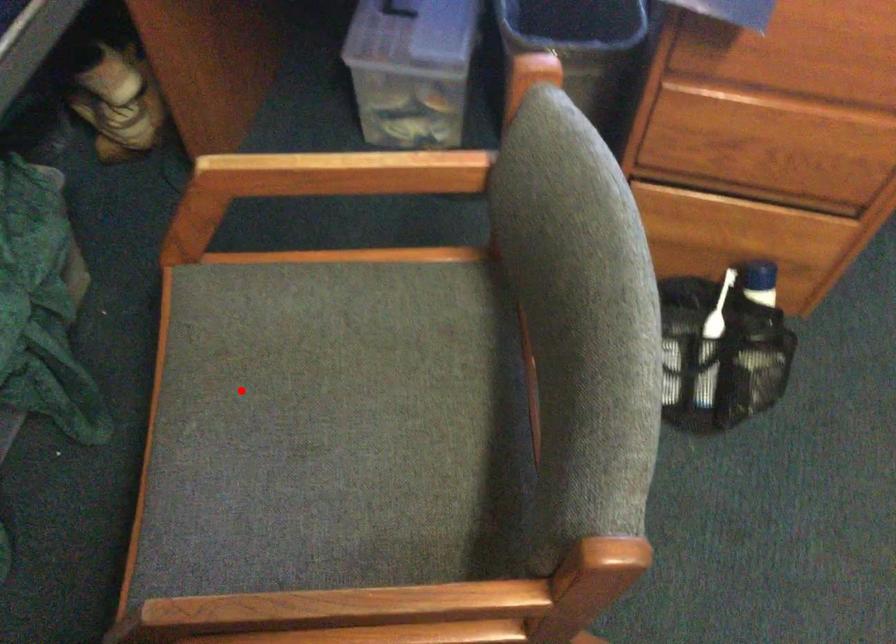
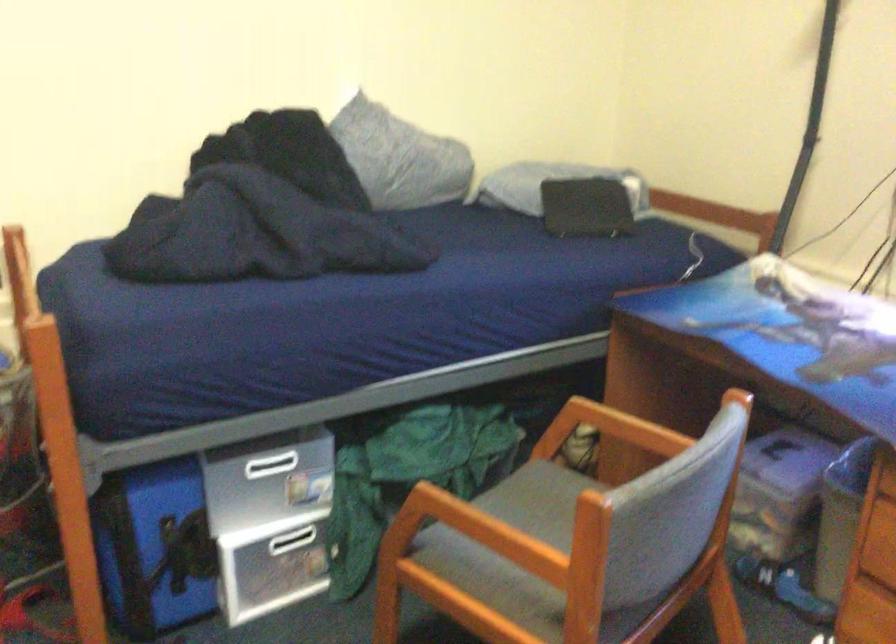
Question: A red point is marked in image1. In image2, is the corresponding 3D point closer to the camera or farther? Reply with the corresponding letter.

Choices:
 (A) The corresponding 3D point is closer.
 (B) The corresponding 3D point is farther.

Answer: (B)